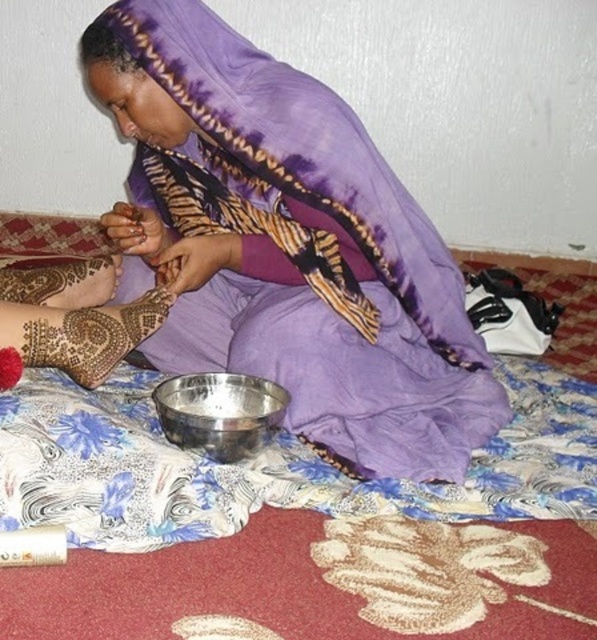
This screenshot has height=640, width=597. What do you see at coordinates (59, 280) in the screenshot?
I see `brown mehendi art at lower left` at bounding box center [59, 280].

Can you confirm if brown mehendi art at lower left is positioned above brown matte henna at center?

No.

Does point (41, 280) lie behind point (152, 227)?

That is True.

Where is `brown mehendi art at lower left`? brown mehendi art at lower left is located at coordinates (59, 280).

Can you confirm if purple satin scarf at upper center is positioned above brown mehendi art at lower left?

Incorrect, purple satin scarf at upper center is not positioned above brown mehendi art at lower left.

Between purple satin scarf at upper center and brown mehendi art at lower left, which one appears on the right side from the viewer's perspective?

purple satin scarf at upper center

Who is more distant from viewer, (418, 432) or (29, 298)?

The point (29, 298) is more distant.

Where is `purple satin scarf at upper center`? purple satin scarf at upper center is located at coordinates (296, 244).

From the picture: How far apart are brown henna at center and brown matte henna at center?

The distance of brown henna at center from brown matte henna at center is 3.71 inches.

From the picture: Which is more to the left, brown henna at center or brown matte henna at center?

brown matte henna at center

Is point (161, 276) positioned after point (162, 241)?

No.

At what (x,y) coordinates should I click in order to perform the action: click on brown henna at center. Please return your answer as a coordinate pair (x, y). Looking at the image, I should click on (195, 260).